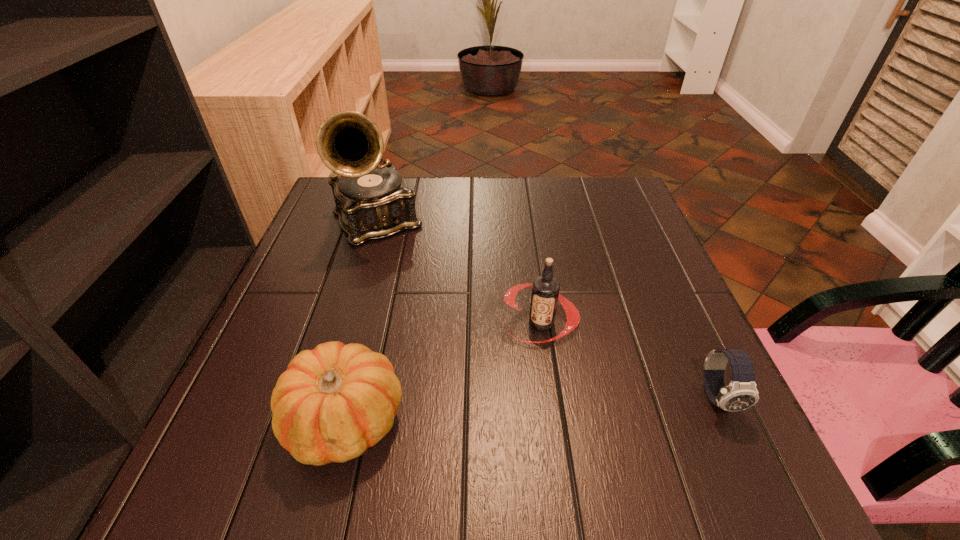
Image resolution: width=960 pixels, height=540 pixels. Find the location of `object that is positioned at the near left corner`. object that is positioned at the near left corner is located at coordinates (334, 402).

In order to click on object that is at the near right corner in this screenshot , I will do `click(741, 393)`.

Find the location of a particular element. The width and height of the screenshot is (960, 540). free location at the far edge is located at coordinates (542, 216).

You are a GUI agent. You are given a task and a screenshot of the screen. Output one action in this format:
    pyautogui.click(x=<x>, y=<y>)
    Task: Click on the free space at the near edge of the desktop
    Image resolution: width=960 pixels, height=540 pixels.
    Given the screenshot: What is the action you would take?
    pyautogui.click(x=517, y=409)

Where is `vacant point at the left edge`? The image size is (960, 540). vacant point at the left edge is located at coordinates (322, 265).

Locate an element on the screen. The width and height of the screenshot is (960, 540). vacant space at the right edge of the desktop is located at coordinates (624, 299).

In the image, there is a desktop. Find the location of `vacant space at the far right corner`. vacant space at the far right corner is located at coordinates (596, 199).

At what (x,y) coordinates should I click in order to perform the action: click on vacant area that lies between the farthest object and the gourd. Please return your answer as a coordinate pair (x, y). Looking at the image, I should click on (361, 321).

Locate an element on the screen. vacant point located between the watch and the second tallest object is located at coordinates (629, 360).

Image resolution: width=960 pixels, height=540 pixels. Find the location of `unoccupied area between the watch and the gourd`. unoccupied area between the watch and the gourd is located at coordinates (532, 409).